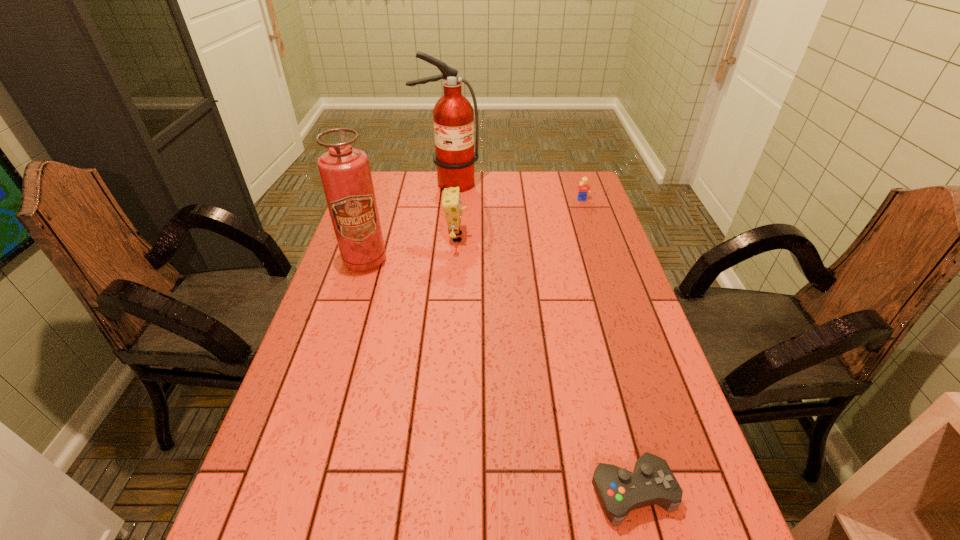
Where is `vacant area in the image that satisfies the following two spatial constraints: 1. on the nozzle and handle of the control; 2. on the right side of the farthest object`? The width and height of the screenshot is (960, 540). vacant area in the image that satisfies the following two spatial constraints: 1. on the nozzle and handle of the control; 2. on the right side of the farthest object is located at coordinates (414, 492).